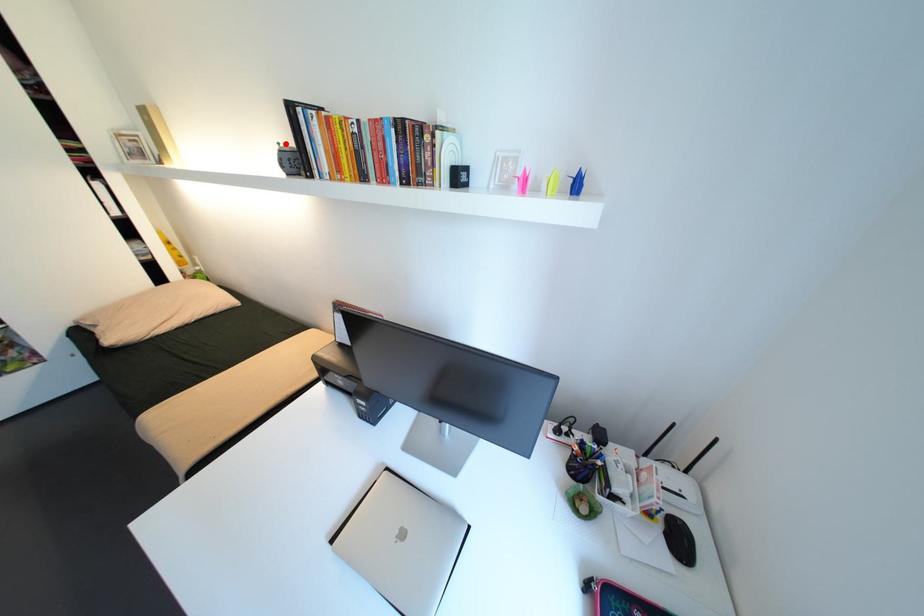
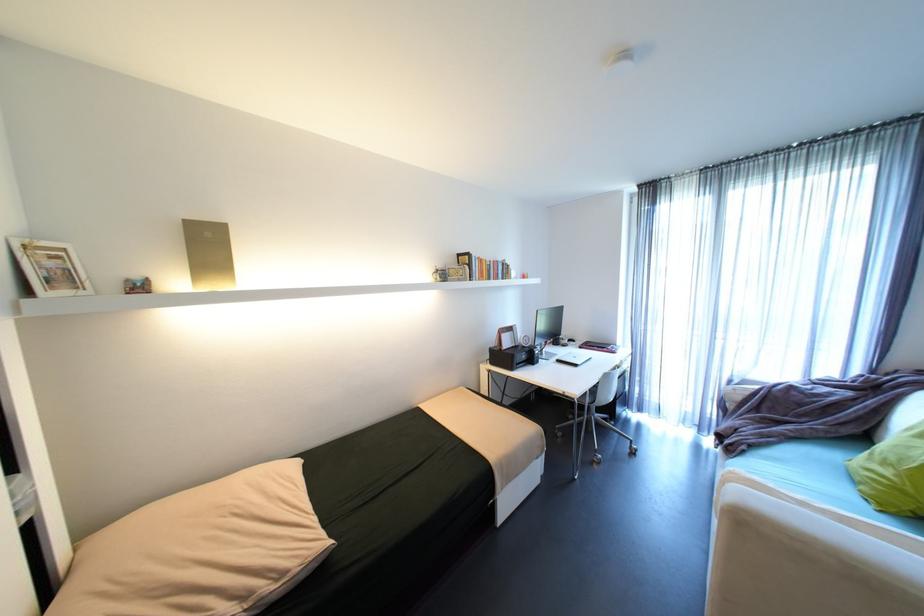
In the second image, find the point that corresponds to the highlighted location in the first image.

(444, 267)